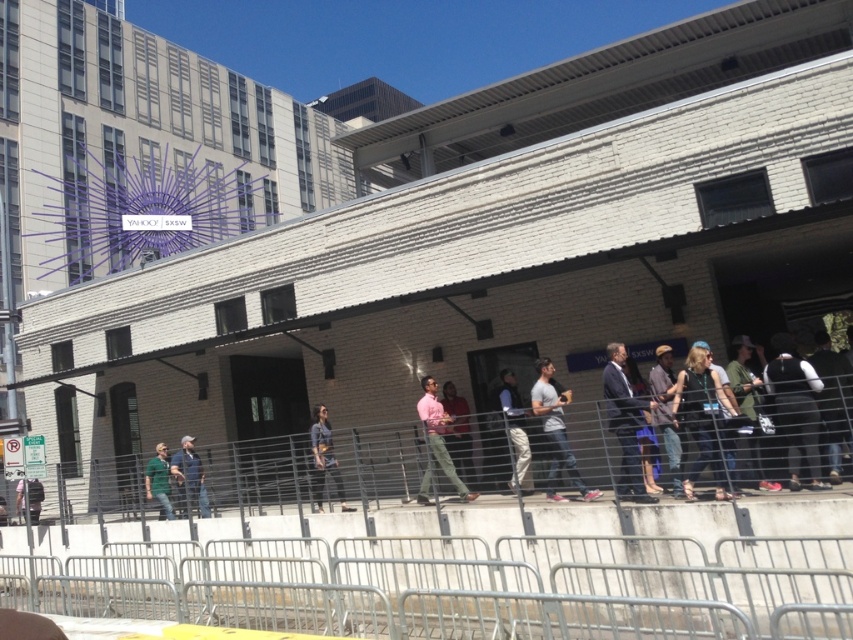
Question: Can you confirm if pink matte shirt at center is positioned to the right of dark gray fabric jacket at center?

Choices:
 (A) yes
 (B) no

Answer: (B)

Question: Which object appears farthest from the camera in this image?

Choices:
 (A) pink matte shirt at center
 (B) light beige pants at center

Answer: (A)

Question: Which of the following is the closest to the observer?

Choices:
 (A) pink matte shirt at center
 (B) blue denim jeans at center
 (C) light gray cotton shirt at center

Answer: (C)

Question: Is blue denim jeans at center wider than green fabric shirt at center?

Choices:
 (A) yes
 (B) no

Answer: (A)

Question: Does denim jacket at center appear on the left side of dark gray sweater at center?

Choices:
 (A) no
 (B) yes

Answer: (B)

Question: Which object is closer to the camera taking this photo?

Choices:
 (A) light gray cotton shirt at center
 (B) denim jacket at center
 (C) dark gray fabric jacket at center

Answer: (B)